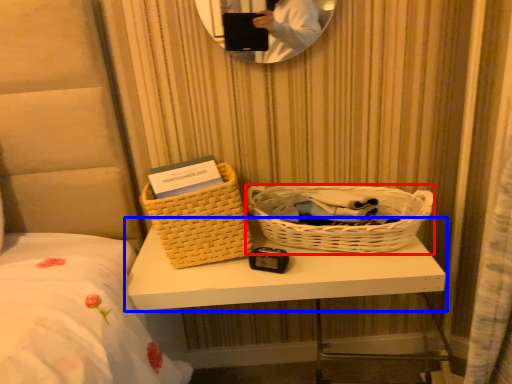
Question: Which point is closer to the camera, picnic basket (highlighted by a red box) or table (highlighted by a blue box)?

Choices:
 (A) picnic basket
 (B) table

Answer: (B)